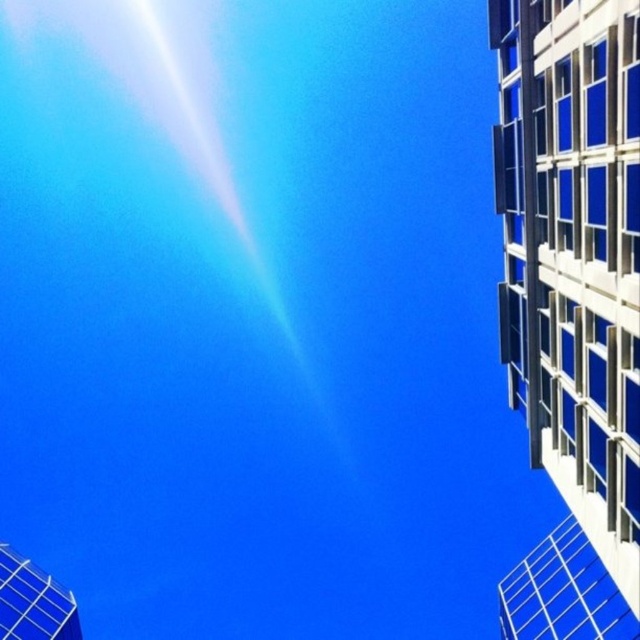
Is white glass building at right taller than metallic grid tower at bottom left?

Indeed, white glass building at right has a greater height compared to metallic grid tower at bottom left.

Who is more forward, (612,72) or (28,584)?

Point (612,72)

At what (x,y) coordinates should I click in order to perform the action: click on white glass building at right. Please return your answer as a coordinate pair (x, y). Looking at the image, I should click on (573, 262).